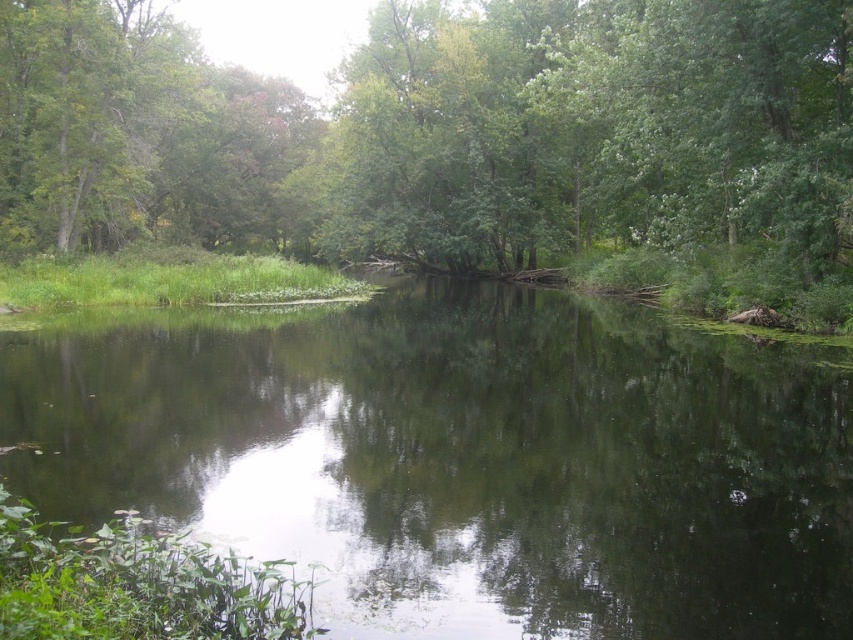
Question: Which point is closer to the camera?

Choices:
 (A) green reflective water at center
 (B) green leafy tree at center

Answer: (A)

Question: Is green reflective water at center wider than green leafy tree at center?

Choices:
 (A) no
 (B) yes

Answer: (A)

Question: Which point is farther to the camera?

Choices:
 (A) (119, 33)
 (B) (581, 545)

Answer: (A)

Question: Observing the image, what is the correct spatial positioning of green reflective water at center in reference to green leafy tree at center?

Choices:
 (A) right
 (B) left

Answer: (A)

Question: Which object appears farthest from the camera in this image?

Choices:
 (A) green reflective water at center
 (B) green leafy tree at center

Answer: (B)

Question: Does green reflective water at center have a greater width compared to green leafy tree at center?

Choices:
 (A) no
 (B) yes

Answer: (A)